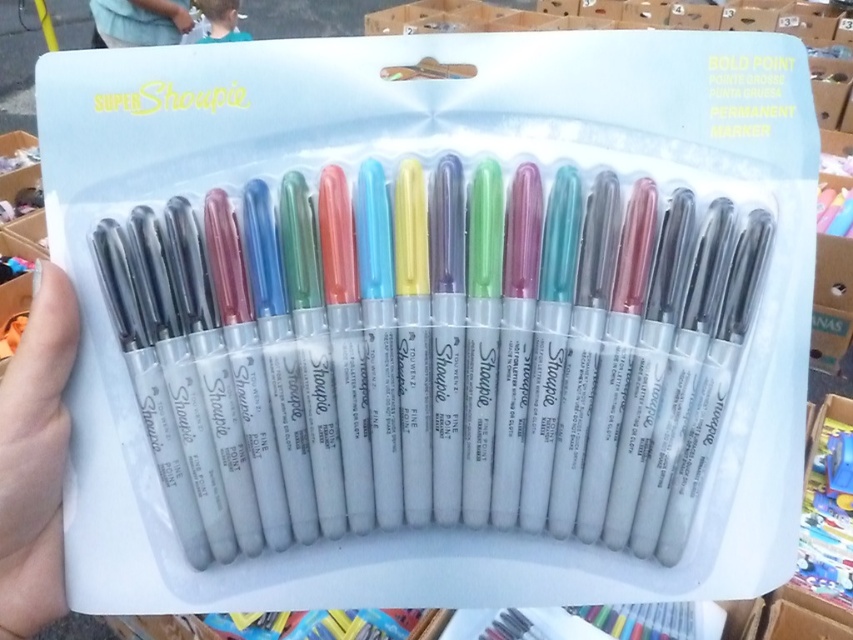
You are an artist holding a white matte hand at lower left and looking at the translucent plastic markers at center in the package. Can you fit the entire package of markers into the palm of your hand? Explain why or why not based on their sizes.

The translucent plastic markers at center are bigger than the white matte hand at lower left. Since the hand is at the lower left and the markers are at the center, the package is larger than the hand, making it impossible to fit the entire package into the palm.

You are holding a Sharpie Super Shoutie marker from the package. You want to write a message on the blue fabric shirt at upper center. However, you notice the white matte hand at lower left is near the shirt. Will the hand block your view of the shirt while writing?

The white matte hand at lower left has a greater height compared to the blue fabric shirt at upper center, so the hand may block your view of the shirt while writing.

You are an office worker who needs to sign a document. You see the translucent plastic markers at center and the blue fabric shirt at upper center. Which object is closer to the bottom of the image?

The translucent plastic markers at center are closer to the bottom of the image because they are located below the blue fabric shirt at upper center.